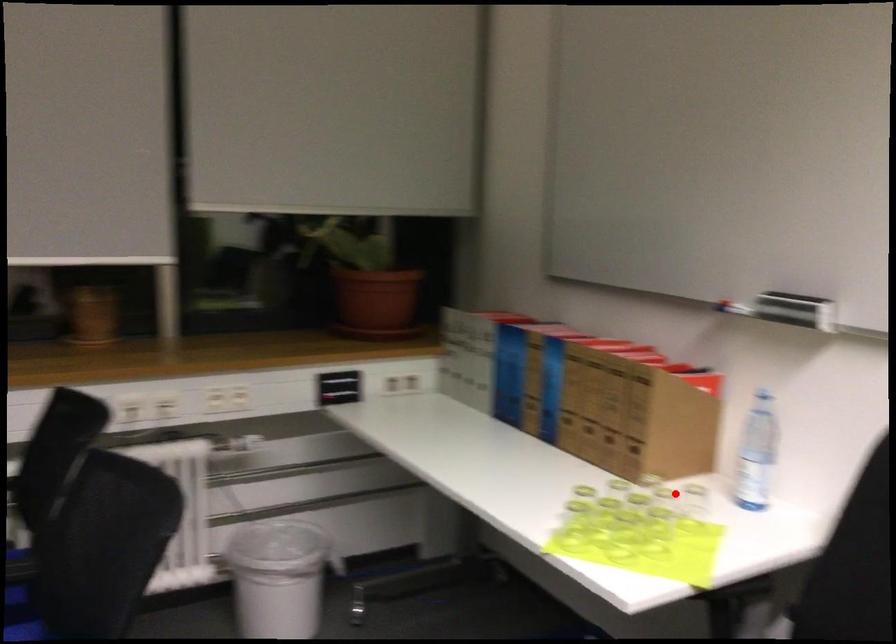
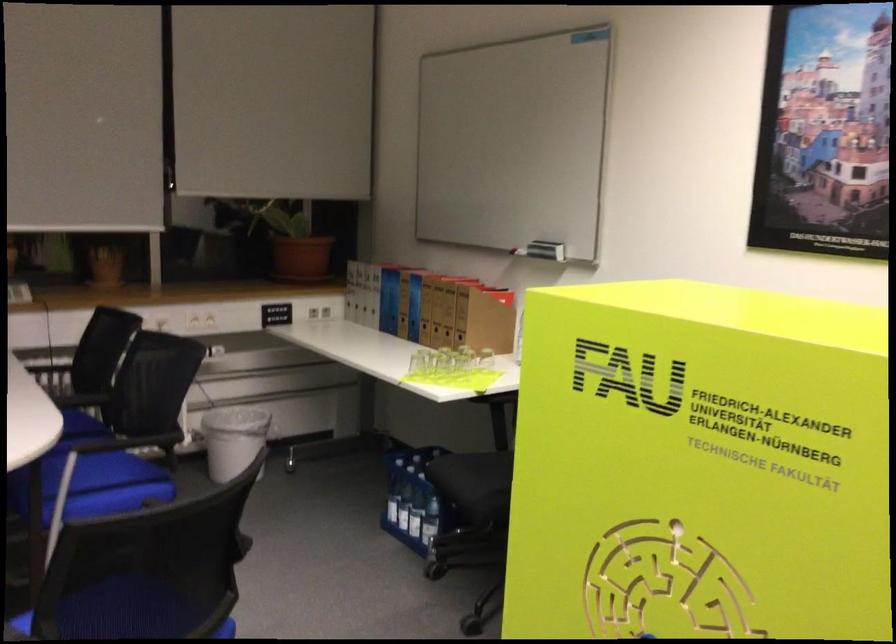
In the second image, find the point that corresponds to the highlighted location in the first image.

(485, 359)